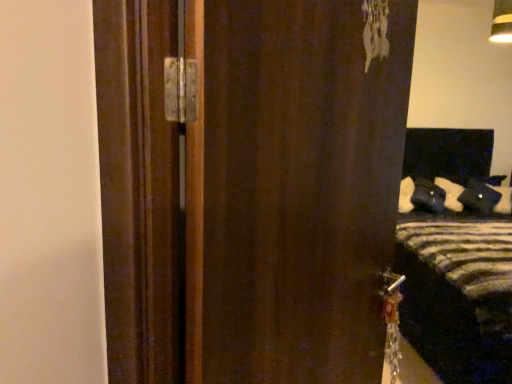
Describe the element at coordinates (292, 191) in the screenshot. I see `brown matte door at center` at that location.

The image size is (512, 384). In order to click on brown matte door at center in this screenshot , I will do `click(292, 191)`.

This screenshot has height=384, width=512. What do you see at coordinates (454, 261) in the screenshot?
I see `striped fabric bed at right` at bounding box center [454, 261].

The width and height of the screenshot is (512, 384). Identify the location of striped fabric bed at right. (454, 261).

Locate an element on the screen. brown matte door at center is located at coordinates tap(292, 191).

Considering the positions of objects striped fabric bed at right and brown matte door at center in the image provided, who is more to the left, striped fabric bed at right or brown matte door at center?

From the viewer's perspective, brown matte door at center appears more on the left side.

Considering their positions, is striped fabric bed at right located in front of or behind brown matte door at center?

Visually, striped fabric bed at right is located behind brown matte door at center.

Considering the positions of point (490, 283) and point (300, 7), is point (490, 283) closer or farther from the camera than point (300, 7)?

Point (490, 283) is farther from the camera than point (300, 7).

From the image's perspective, is striped fabric bed at right above brown matte door at center?

No, from the image's perspective, striped fabric bed at right is not above brown matte door at center.

From a real-world perspective, which object rests below the other?

striped fabric bed at right is physically lower.

Based on the photo, considering the relative sizes of striped fabric bed at right and brown matte door at center in the image provided, is striped fabric bed at right thinner than brown matte door at center?

No.

Which of these two, striped fabric bed at right or brown matte door at center, stands taller?

Standing taller between the two is striped fabric bed at right.

Who is smaller, striped fabric bed at right or brown matte door at center?

With smaller size is brown matte door at center.

Is striped fabric bed at right not inside brown matte door at center?

striped fabric bed at right is positioned outside brown matte door at center.

Are striped fabric bed at right and brown matte door at center far apart?

Yes.

Could you tell me if striped fabric bed at right is facing brown matte door at center?

No, striped fabric bed at right is not oriented towards brown matte door at center.

Consider the image. What's the angular difference between striped fabric bed at right and brown matte door at center's facing directions?

There is a 44.2-degree angle between the facing directions of striped fabric bed at right and brown matte door at center.

Measure the distance between striped fabric bed at right and brown matte door at center.

striped fabric bed at right is 6.19 feet away from brown matte door at center.

You are a GUI agent. You are given a task and a screenshot of the screen. Output one action in this format:
    pyautogui.click(x=<x>, y=<y>)
    Task: Click on the bed that appears below the brown matte door at center (from the image's perspective)
    
    Given the screenshot: What is the action you would take?
    pyautogui.click(x=454, y=261)

Which object is positioned more to the left, brown matte door at center or striped fabric bed at right?

brown matte door at center.

Which is behind, brown matte door at center or striped fabric bed at right?

striped fabric bed at right is further from the camera.

Does point (270, 197) come behind point (499, 266)?

No, it is in front of (499, 266).

From the image's perspective, is brown matte door at center positioned above or below striped fabric bed at right?

brown matte door at center is above striped fabric bed at right.

From a real-world perspective, is brown matte door at center on striped fabric bed at right?

Yes, from a real-world perspective, brown matte door at center is above striped fabric bed at right.

Between brown matte door at center and striped fabric bed at right, which one has larger width?

With larger width is striped fabric bed at right.

Is brown matte door at center shorter than striped fabric bed at right?

Correct, brown matte door at center is not as tall as striped fabric bed at right.

From the picture: Between brown matte door at center and striped fabric bed at right, which one has larger size?

Bigger between the two is striped fabric bed at right.

Can we say brown matte door at center lies outside striped fabric bed at right?

Indeed, brown matte door at center is completely outside striped fabric bed at right.

Is brown matte door at center directly adjacent to striped fabric bed at right?

No, brown matte door at center is not beside striped fabric bed at right.

Is brown matte door at center looking in the opposite direction of striped fabric bed at right?

No.

How different are the orientations of brown matte door at center and striped fabric bed at right in degrees?

They differ by 44.2 degrees in their facing directions.

Identify the location of door positioned vertically above the striped fabric bed at right (from a real-world perspective). (292, 191).

Where is `bed lying below the brown matte door at center (from the image's perspective)`? bed lying below the brown matte door at center (from the image's perspective) is located at coordinates (454, 261).

You are a GUI agent. You are given a task and a screenshot of the screen. Output one action in this format:
    pyautogui.click(x=<x>, y=<y>)
    Task: Click on the door that appears in front of the striped fabric bed at right
    This screenshot has height=384, width=512.
    Given the screenshot: What is the action you would take?
    pyautogui.click(x=292, y=191)